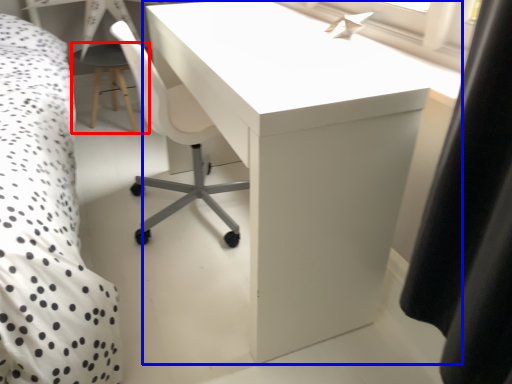
Question: Which object is closer to the camera taking this photo, side table (highlighted by a red box) or table (highlighted by a blue box)?

Choices:
 (A) side table
 (B) table

Answer: (B)